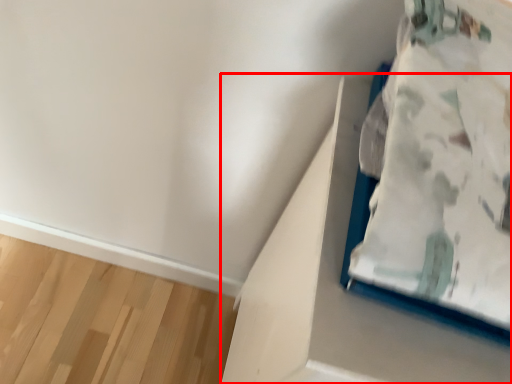
Question: From the image's perspective, where is cardboard box (annotated by the red box) located in relation to furniture in the image?

Choices:
 (A) below
 (B) above

Answer: (A)